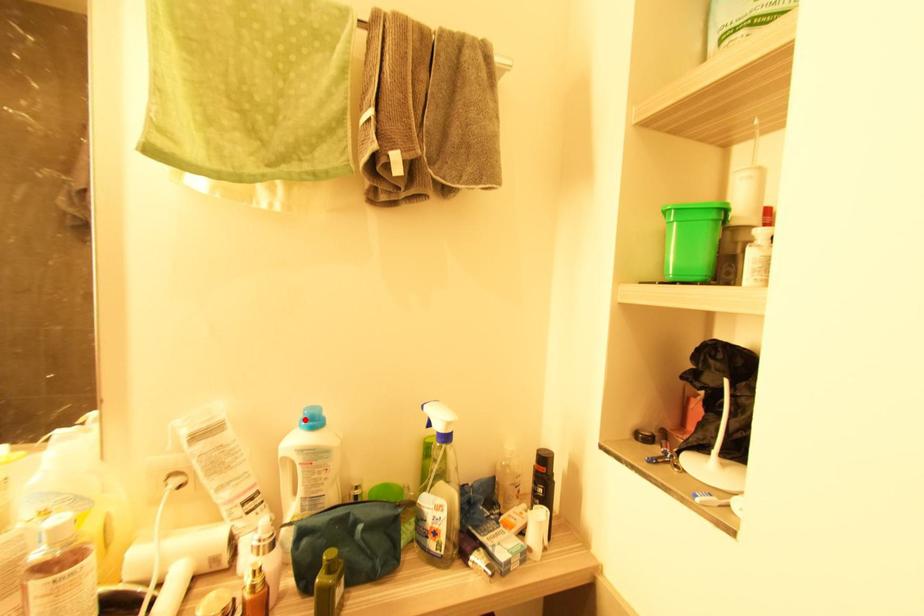
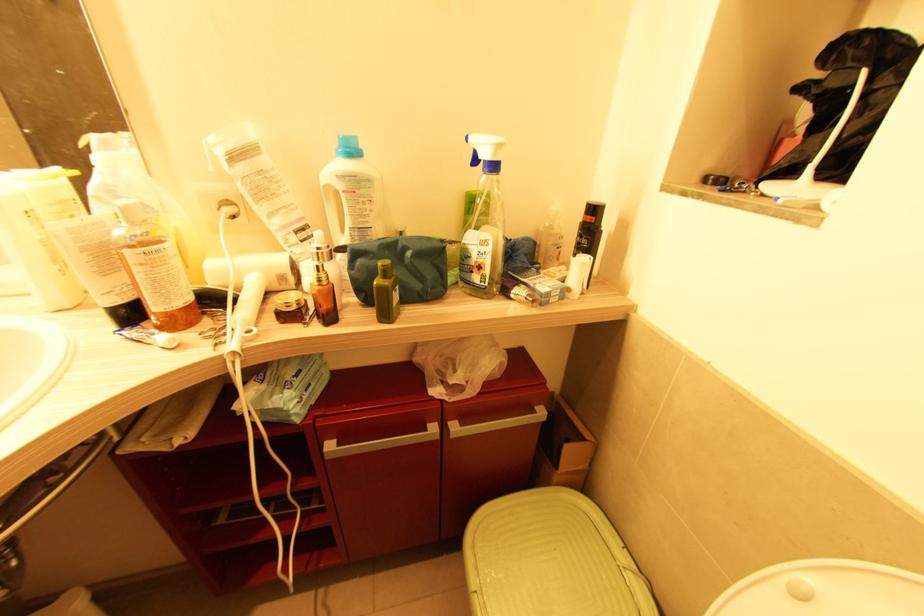
Find the pixel in the second image that matches the highlighted location in the first image.

(341, 148)